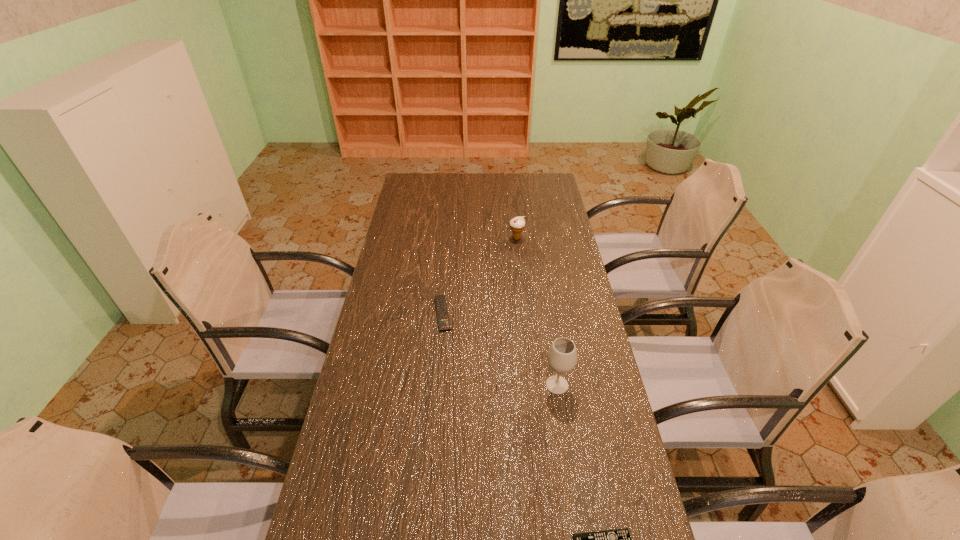
Select which object appears as the third closest to the farthest object. Please provide its 2D coordinates. Your answer should be formatted as a tuple, i.e. [(x, y)], where the tuple contains the x and y coordinates of a point satisfying the conditions above.

[(619, 539)]

Image resolution: width=960 pixels, height=540 pixels. Find the location of `free space that satisfies the following two spatial constraints: 1. on the front side of the third nearest object; 2. on the right side of the tallest object`. free space that satisfies the following two spatial constraints: 1. on the front side of the third nearest object; 2. on the right side of the tallest object is located at coordinates (436, 385).